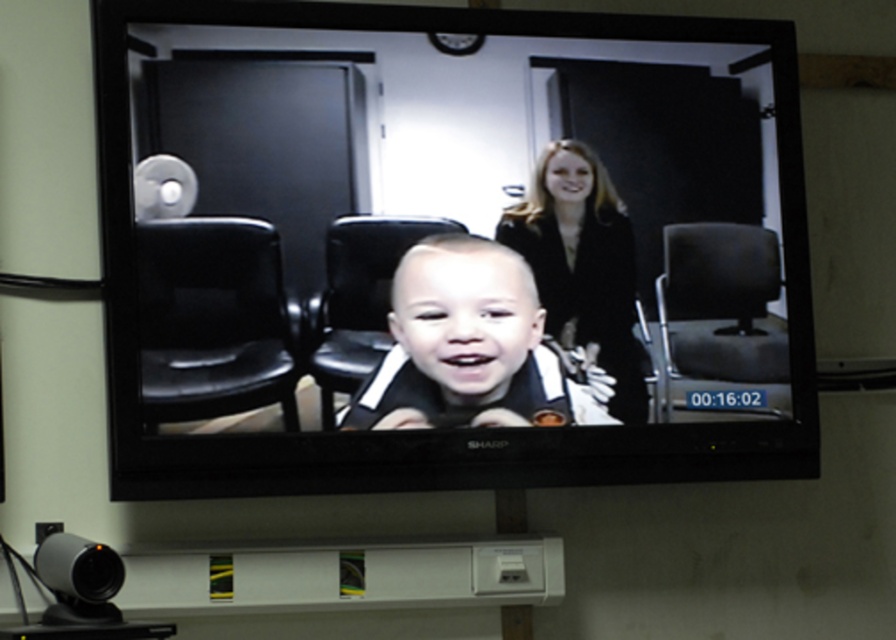
You are sitting in the living room and looking at the TV screen. You see a black leather chair at left and a black smooth suit at upper center. Which object is closer to the bottom edge of the TV screen?

The black leather chair at left is closer to the bottom edge of the TV screen because it is positioned below the black smooth suit at upper center.

You are attending a virtual meeting and see the black leather chair at left and the black smooth suit at upper center on your screen. Which object is nearer to you in the scene?

The black leather chair at left is closer to the viewer than the black smooth suit at upper center.

You are standing in front of the Sharp brand flat screen TV mounted on the wall. You want to place a small plant exactly at the point with coordinates point [448,289] on the TV screen. The plant needs to be placed at a distance of 2 meters from your current position. Can you place the plant at that point?

The distance of point [448,289] from camera is 2.10 meters, so yes, the plant can be placed at that point since it is within the required 2 meters distance.